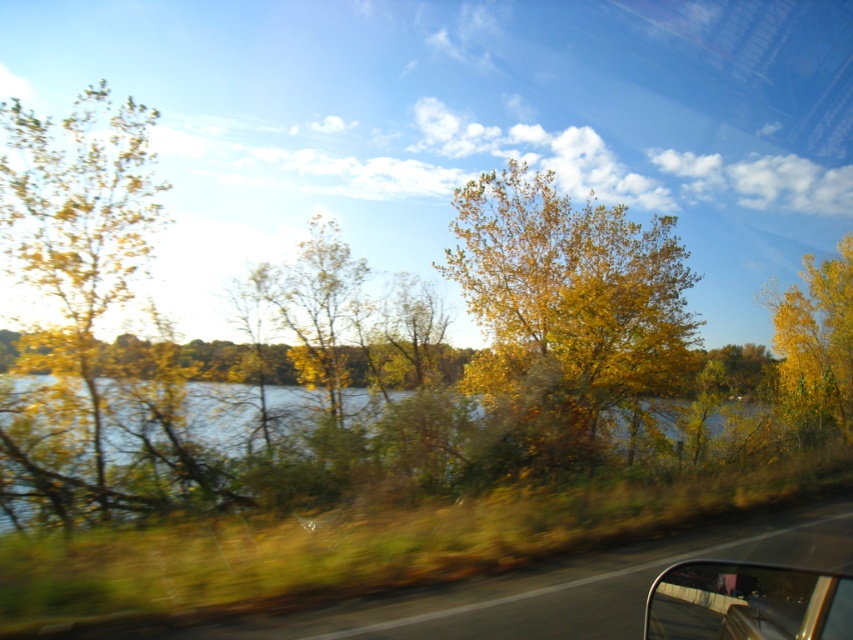
Question: Which point is closer to the camera?

Choices:
 (A) yellow-green leaves at left
 (B) yellow leafy tree at right

Answer: (A)

Question: Which object is positioned farthest from the greenish-blue water at center?

Choices:
 (A) yellow leafy tree at right
 (B) yellow-green leaves at left

Answer: (A)

Question: Considering the relative positions of yellow/golden leaves at center and yellow-green leaves at left in the image provided, where is yellow/golden leaves at center located with respect to yellow-green leaves at left?

Choices:
 (A) below
 (B) above

Answer: (A)

Question: Which of these objects is positioned closest to the greenish-blue water at center?

Choices:
 (A) transparent glass car window at lower right
 (B) yellow-green leaves at left
 (C) yellow/golden leaves at center
 (D) yellow leafy tree at right

Answer: (C)

Question: Is yellow/golden leaves at center bigger than yellow leafy tree at right?

Choices:
 (A) no
 (B) yes

Answer: (B)

Question: Can you confirm if yellow-green leaves at left is positioned above transparent glass car window at lower right?

Choices:
 (A) no
 (B) yes

Answer: (B)